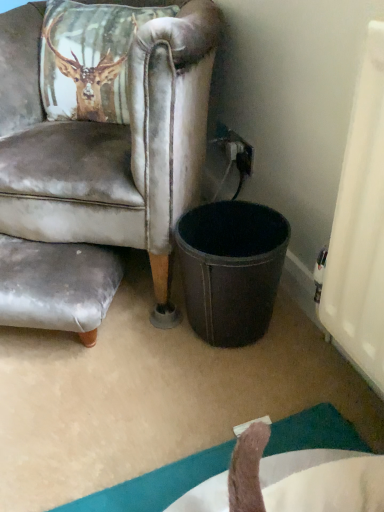
This screenshot has height=512, width=384. What are the coordinates of `black leather trash bin/can at lower center` in the screenshot? It's located at (231, 269).

You are a GUI agent. You are given a task and a screenshot of the screen. Output one action in this format:
    pyautogui.click(x=<x>, y=<y>)
    Task: Click on the black plastic power outlet at upper right
    
    Given the screenshot: What is the action you would take?
    pyautogui.click(x=243, y=152)

Find the location of a particular element. This screenshot has height=512, width=384. gray fabric swivel chair at lower left is located at coordinates (57, 285).

Can you confirm if leather at right is taller than gray fabric swivel chair at lower left?

Correct, leather at right is much taller as gray fabric swivel chair at lower left.

Does leather at right have a lesser width compared to gray fabric swivel chair at lower left?

No.

Which is more distant, (0, 152) or (22, 294)?

The point (0, 152) is farther from the camera.

From the image's perspective, does leather at right appear lower than gray fabric swivel chair at lower left?

Incorrect, from the image's perspective, leather at right is higher than gray fabric swivel chair at lower left.

Is black plastic power outlet at upper right beside leather at right?

black plastic power outlet at upper right and leather at right are not in contact.

In the scene shown: Is black plastic power outlet at upper right to the left of leather at right from the viewer's perspective?

In fact, black plastic power outlet at upper right is to the right of leather at right.

From the image's perspective, which one is positioned higher, black plastic power outlet at upper right or leather at right?

leather at right appears higher in the image.

From a real-world perspective, which is physically above, leather at right or black leather trash bin/can at lower center?

leather at right is physically above.

Image resolution: width=384 pixels, height=512 pixels. I want to click on trash bin/can that appears behind the leather at right, so click(231, 269).

From the image's perspective, between leather at right and black leather trash bin/can at lower center, who is located below?

black leather trash bin/can at lower center appears lower in the image.

Between black plastic power outlet at upper right and gray fabric swivel chair at lower left, which one is positioned in front?

Positioned in front is gray fabric swivel chair at lower left.

Would you say black plastic power outlet at upper right is inside or outside gray fabric swivel chair at lower left?

The correct answer is: outside.

The width and height of the screenshot is (384, 512). There is a gray fabric swivel chair at lower left. Find the location of `power outlet above it (from a real-world perspective)`. power outlet above it (from a real-world perspective) is located at coordinates (243, 152).

Is gray fabric swivel chair at lower left not close to black leather trash bin/can at lower center?

They are positioned close to each other.

From a real-world perspective, which is physically above, gray fabric swivel chair at lower left or black leather trash bin/can at lower center?

From a 3D spatial view, black leather trash bin/can at lower center is above.

From the image's perspective, is gray fabric swivel chair at lower left over black leather trash bin/can at lower center?

No, from the image's perspective, gray fabric swivel chair at lower left is not on top of black leather trash bin/can at lower center.

Is gray fabric swivel chair at lower left positioned in front of black leather trash bin/can at lower center?

No, gray fabric swivel chair at lower left is behind black leather trash bin/can at lower center.

Which of these two, gray fabric swivel chair at lower left or black plastic power outlet at upper right, is bigger?

Bigger between the two is gray fabric swivel chair at lower left.

From a real-world perspective, which is physically below, gray fabric swivel chair at lower left or black plastic power outlet at upper right?

gray fabric swivel chair at lower left.

Between point (1, 279) and point (235, 133), which one is positioned in front?

Positioned in front is point (1, 279).

Is gray fabric swivel chair at lower left thinner than black plastic power outlet at upper right?

No.

Is leather at right at the left side of black plastic power outlet at upper right?

Yes, leather at right is to the left of black plastic power outlet at upper right.

Looking at this image, is leather at right looking in the opposite direction of black plastic power outlet at upper right?

No, leather at right's orientation is not away from black plastic power outlet at upper right.

The width and height of the screenshot is (384, 512). Identify the location of chair in front of the gray fabric swivel chair at lower left. coord(100,167).

Locate an element on the screen. Image resolution: width=384 pixels, height=512 pixels. power outlet that is on the right side of leather at right is located at coordinates (243, 152).

Looking at the image, which one is located further to leather at right, gray fabric swivel chair at lower left or black plastic power outlet at upper right?

black plastic power outlet at upper right.

Considering their positions, is black plastic power outlet at upper right positioned further to gray fabric swivel chair at lower left than black leather trash bin/can at lower center?

black plastic power outlet at upper right is positioned further to the anchor gray fabric swivel chair at lower left.

From the image, which object appears to be nearer to gray fabric swivel chair at lower left, leather at right or black leather trash bin/can at lower center?

Among the two, leather at right is located nearer to gray fabric swivel chair at lower left.

Considering their positions, is black leather trash bin/can at lower center positioned closer to leather at right than gray fabric swivel chair at lower left?

gray fabric swivel chair at lower left.

When comparing their distances from leather at right, does gray fabric swivel chair at lower left or black leather trash bin/can at lower center seem further?

black leather trash bin/can at lower center lies further to leather at right than the other object.

Which object lies nearer to the anchor point black leather trash bin/can at lower center, gray fabric swivel chair at lower left or leather at right?

The object closer to black leather trash bin/can at lower center is leather at right.

In the scene shown: Looking at the image, which one is located further to black plastic power outlet at upper right, leather at right or black leather trash bin/can at lower center?

leather at right lies further to black plastic power outlet at upper right than the other object.

When comparing their distances from black leather trash bin/can at lower center, does black plastic power outlet at upper right or gray fabric swivel chair at lower left seem closer?

The object closer to black leather trash bin/can at lower center is gray fabric swivel chair at lower left.

Locate an element on the screen. trash bin/can between gray fabric swivel chair at lower left and black plastic power outlet at upper right is located at coordinates (231, 269).

What are the coordinates of `chair between gray fabric swivel chair at lower left and black leather trash bin/can at lower center from left to right` in the screenshot? It's located at (100, 167).

This screenshot has height=512, width=384. I want to click on chair between gray fabric swivel chair at lower left and black plastic power outlet at upper right in the horizontal direction, so click(x=100, y=167).

Identify the location of trash bin/can between leather at right and black plastic power outlet at upper right from front to back. (231, 269).